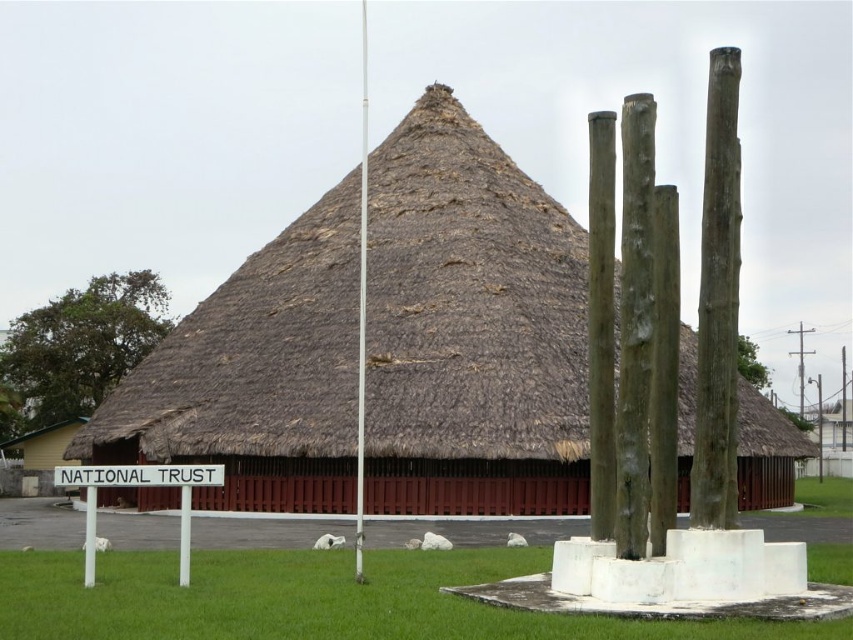
Does white smooth pole at center have a larger size compared to white plastic sign at center?

Yes, white smooth pole at center is bigger than white plastic sign at center.

Which is above, white smooth pole at center or white plastic sign at center?

Positioned higher is white smooth pole at center.

Is point (366, 179) closer to camera compared to point (204, 467)?

No, (366, 179) is further to viewer.

Find the location of a particular element. The image size is (853, 640). white smooth pole at center is located at coordinates (361, 300).

Does white plastic sign at lower left lie behind white plastic sign at center?

No, it is not.

Locate an element on the screen. white plastic sign at lower left is located at coordinates (138, 486).

Is the position of green grass at lower center more distant than that of white plastic sign at lower left?

No, it is not.

At what (x,y) coordinates should I click in order to perform the action: click on green grass at lower center. Please return your answer as a coordinate pair (x, y). The image size is (853, 640). Looking at the image, I should click on (315, 600).

Is point (592, 634) positioned in front of point (193, 484)?

Yes, it is in front of point (193, 484).

Locate an element on the screen. green grass at lower center is located at coordinates (315, 600).